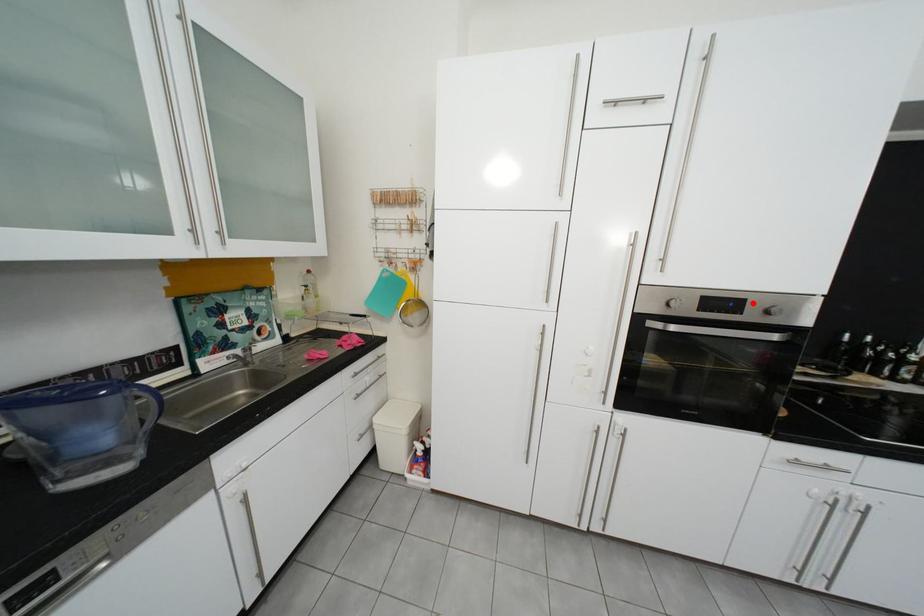
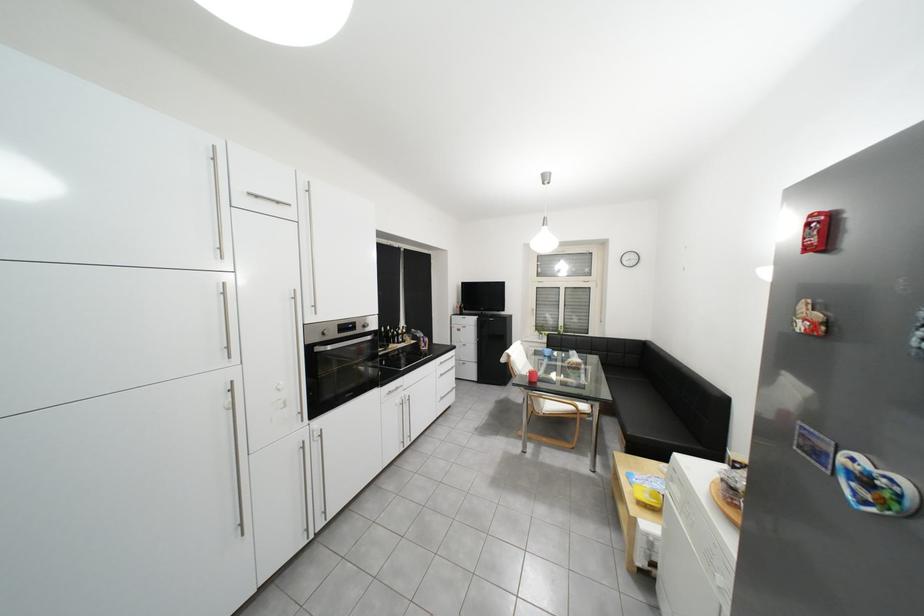
Where in the second image is the point corresponding to the highlighted location from the first image?

(366, 325)